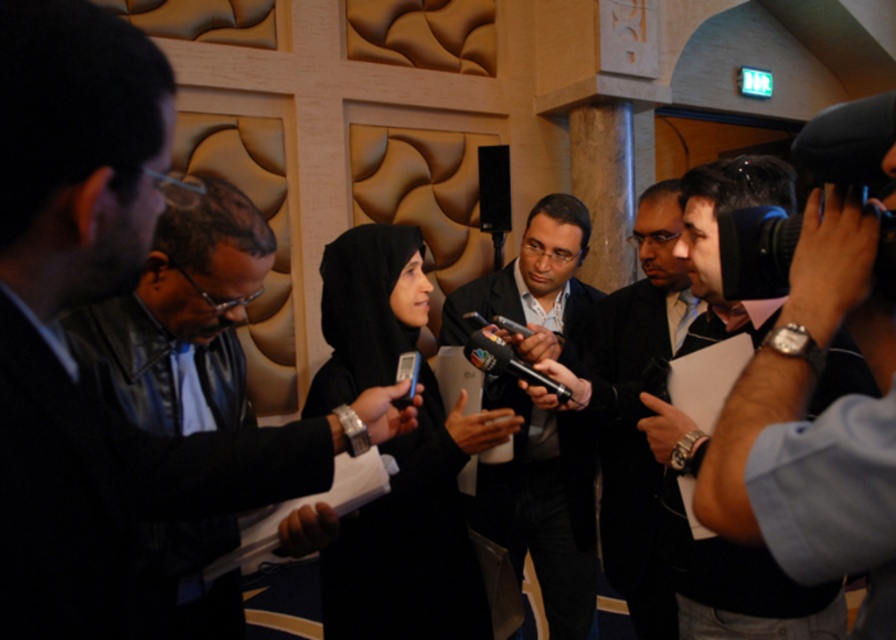
Between matte black suit at center and black leather camera at right, which one appears on the right side from the viewer's perspective?

Positioned to the right is black leather camera at right.

Who is more forward, (593,588) or (717,228)?

Point (717,228) is more forward.

Where is `matte black suit at center`? matte black suit at center is located at coordinates (543, 508).

How much distance is there between black leather jacket at left and black leather camera at right?

The distance of black leather jacket at left from black leather camera at right is 25.54 inches.

Does point (22, 54) lie behind point (725, 572)?

No.

Locate an element on the screen. This screenshot has height=640, width=896. black leather jacket at left is located at coordinates (82, 301).

Does matte black suit at center appear on the right side of dark suit at center?

Incorrect, matte black suit at center is not on the right side of dark suit at center.

Which is in front, point (540, 445) or point (639, 241)?

Positioned in front is point (639, 241).

At what (x,y) coordinates should I click in order to perform the action: click on matte black suit at center. Please return your answer as a coordinate pair (x, y). Image resolution: width=896 pixels, height=640 pixels. Looking at the image, I should click on (543, 508).